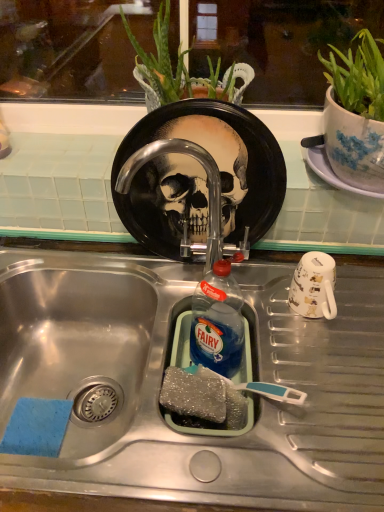
What is the approximate width of blue translucent liquid at sink center?

The width of blue translucent liquid at sink center is 3.42 inches.

Locate an element on the screen. Image resolution: width=384 pixels, height=512 pixels. blue translucent liquid at sink center is located at coordinates (217, 322).

Based on the photo, measure the distance between green leafy plant at center and camera.

green leafy plant at center and camera are 77.17 centimeters apart.

What do you see at coordinates (180, 70) in the screenshot?
I see `green leafy plant at center` at bounding box center [180, 70].

Where is `black glossy plate at center`? The image size is (384, 512). black glossy plate at center is located at coordinates (198, 177).

Measure the distance between stainless steel sink at center and camera.

stainless steel sink at center and camera are 54.14 centimeters apart from each other.

Where is `white glossy mug at right`? white glossy mug at right is located at coordinates (314, 286).

What's the angular difference between stainless steel sink at center and white glossy mug at right's facing directions?

0.00173 degrees.

Which object is further away from the camera, stainless steel sink at center or white glossy mug at right?

white glossy mug at right is behind.

Is stainless steel sink at center oriented away from white glossy mug at right?

No, stainless steel sink at center is not facing away from white glossy mug at right.

Which of these two, stainless steel sink at center or white glossy mug at right, is bigger?

Bigger between the two is stainless steel sink at center.

Is black glossy plate at center completely or partially outside of sparkly gray sponge at sink bottom?

black glossy plate at center lies outside sparkly gray sponge at sink bottom's area.

From the image's perspective, which is above, black glossy plate at center or sparkly gray sponge at sink bottom?

From the image's view, black glossy plate at center is above.

From a real-world perspective, which is physically below, black glossy plate at center or sparkly gray sponge at sink bottom?

From a 3D spatial view, sparkly gray sponge at sink bottom is below.

Is black glossy plate at center facing towards sparkly gray sponge at sink bottom?

Yes, black glossy plate at center is turned towards sparkly gray sponge at sink bottom.

Find the location of a particular element. Image resolution: width=384 pixels, height=512 pixels. bottle that is above the stainless steel sink at center (from a real-world perspective) is located at coordinates click(x=217, y=322).

Is stainless steel sink at center to the left of blue translucent liquid at sink center from the viewer's perspective?

Yes, stainless steel sink at center is to the left of blue translucent liquid at sink center.

In the image, is stainless steel sink at center positioned in front of or behind blue translucent liquid at sink center?

In the image, stainless steel sink at center appears in front of blue translucent liquid at sink center.

Is white glossy mug at right completely or partially outside of green leafy plant at center?

Yes, white glossy mug at right is located beyond the bounds of green leafy plant at center.

Would you consider white glossy mug at right to be distant from green leafy plant at center?

That's not correct — white glossy mug at right is a little close to green leafy plant at center.

From a real-world perspective, which object rests below the other?

From a 3D spatial view, white glossy mug at right is below.

Who is bigger, white glossy mug at right or green leafy plant at center?

green leafy plant at center.

Which is in front, point (191, 413) or point (295, 383)?

Point (191, 413)

From the picture: Is sparkly gray sponge at sink bottom aimed at stainless steel sink at center?

Yes.

Based on the photo, from a real-world perspective, which is physically above, sparkly gray sponge at sink bottom or stainless steel sink at center?

sparkly gray sponge at sink bottom.

Is sparkly gray sponge at sink bottom positioned far away from stainless steel sink at center?

No, there isn't a large distance between sparkly gray sponge at sink bottom and stainless steel sink at center.

Is point (159, 72) positioned after point (311, 296)?

Yes, it is behind point (311, 296).

Based on the photo, how much distance is there between green leafy plant at center and white glossy mug at right?

They are 16.85 inches apart.

Is green leafy plant at center in front of white glossy mug at right?

Yes, green leafy plant at center is closer to the camera.

Is green leafy plant at center smaller than white glossy mug at right?

No, green leafy plant at center is not smaller than white glossy mug at right.

Who is bigger, black glossy plate at center or blue translucent liquid at sink center?

black glossy plate at center is bigger.

Does black glossy plate at center lie in front of blue translucent liquid at sink center?

No, black glossy plate at center is further to the viewer.

This screenshot has width=384, height=512. Find the location of `sink below the white glossy mug at right (from a real-world perspective)`. sink below the white glossy mug at right (from a real-world perspective) is located at coordinates (168, 364).

At what (x,y) coordinates should I click in order to perform the action: click on plate above the sparkly gray sponge at sink bottom (from the image's perspective). Please return your answer as a coordinate pair (x, y). The image size is (384, 512). Looking at the image, I should click on (198, 177).

From the image, which object appears to be nearer to stainless steel sink at center, blue translucent liquid at sink center or black glossy plate at center?

blue translucent liquid at sink center is closer to stainless steel sink at center.

Considering their positions, is blue translucent liquid at sink center positioned further to sparkly gray sponge at sink bottom than black glossy plate at center?

The object further to sparkly gray sponge at sink bottom is black glossy plate at center.

Considering their positions, is sparkly gray sponge at sink bottom positioned further to blue translucent liquid at sink center than black glossy plate at center?

black glossy plate at center is further to blue translucent liquid at sink center.

Estimate the real-world distances between objects in this image. Which object is closer to white glossy mug at right, blue translucent liquid at sink center or black glossy plate at center?

Based on the image, blue translucent liquid at sink center appears to be nearer to white glossy mug at right.

From the image, which object appears to be farther from green leafy plant at center, sparkly gray sponge at sink bottom or blue translucent liquid at sink center?

The object further to green leafy plant at center is sparkly gray sponge at sink bottom.

When comparing their distances from green leafy plant at center, does sparkly gray sponge at sink bottom or black glossy plate at center seem further?

sparkly gray sponge at sink bottom is positioned further to the anchor green leafy plant at center.

Based on their spatial positions, is white glossy mug at right or sparkly gray sponge at sink bottom further from green leafy plant at center?

Among the two, sparkly gray sponge at sink bottom is located further to green leafy plant at center.

Looking at the image, which one is located further to green leafy plant at center, black glossy plate at center or stainless steel sink at center?

stainless steel sink at center is further to green leafy plant at center.

The image size is (384, 512). In order to click on plate between green leafy plant at center and white glossy mug at right in the vertical direction in this screenshot , I will do `click(198, 177)`.

Locate an element on the screen. The width and height of the screenshot is (384, 512). bottle between sparkly gray sponge at sink bottom and white glossy mug at right is located at coordinates 217,322.

Identify the location of coffee cup between black glossy plate at center and stainless steel sink at center from top to bottom. (314, 286).

Locate an element on the screen. Image resolution: width=384 pixels, height=512 pixels. bottle between black glossy plate at center and stainless steel sink at center in the up-down direction is located at coordinates (217, 322).